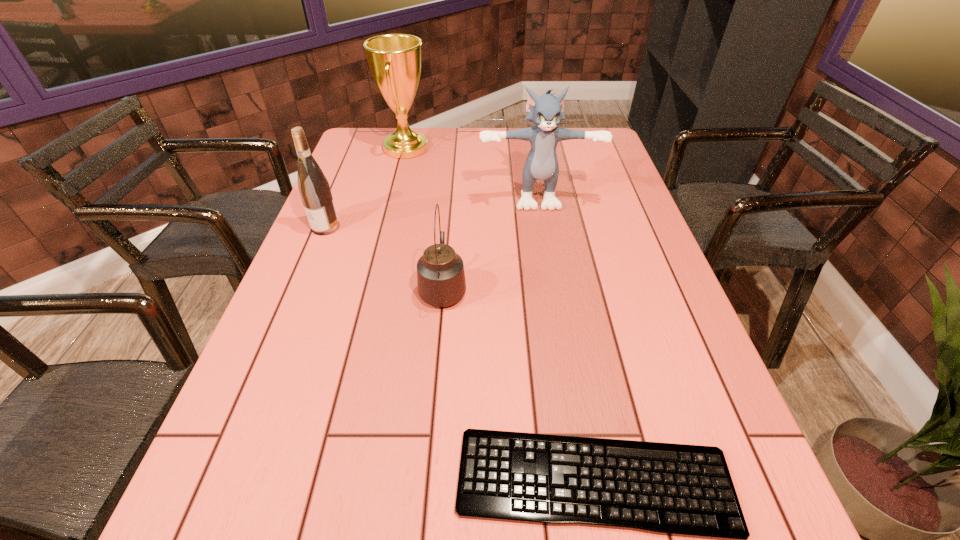
Choose which object is the third nearest neighbor to the leftmost object. Please provide its 2D coordinates. Your answer should be formatted as a tuple, i.e. [(x, y)], where the tuple contains the x and y coordinates of a point satisfying the conditions above.

[(545, 111)]

You are a GUI agent. You are given a task and a screenshot of the screen. Output one action in this format:
    pyautogui.click(x=<x>, y=<y>)
    Task: Click on the object that stands as the closest to the award
    The height and width of the screenshot is (540, 960).
    Given the screenshot: What is the action you would take?
    pyautogui.click(x=545, y=111)

Identify the location of vacant space that satisfies the following two spatial constraints: 1. spout on the kettle; 2. by the handles of the farthest object. This screenshot has width=960, height=540. (455, 148).

Image resolution: width=960 pixels, height=540 pixels. I want to click on free space that satisfies the following two spatial constraints: 1. by the handles of the farthest object; 2. spout on the kettle, so click(x=372, y=287).

You are a GUI agent. You are given a task and a screenshot of the screen. Output one action in this format:
    pyautogui.click(x=<x>, y=<y>)
    Task: Click on the vacant area that satisfies the following two spatial constraints: 1. by the handles of the farthest object; 2. spout on the fourth farthest object
    
    Given the screenshot: What is the action you would take?
    pyautogui.click(x=372, y=287)